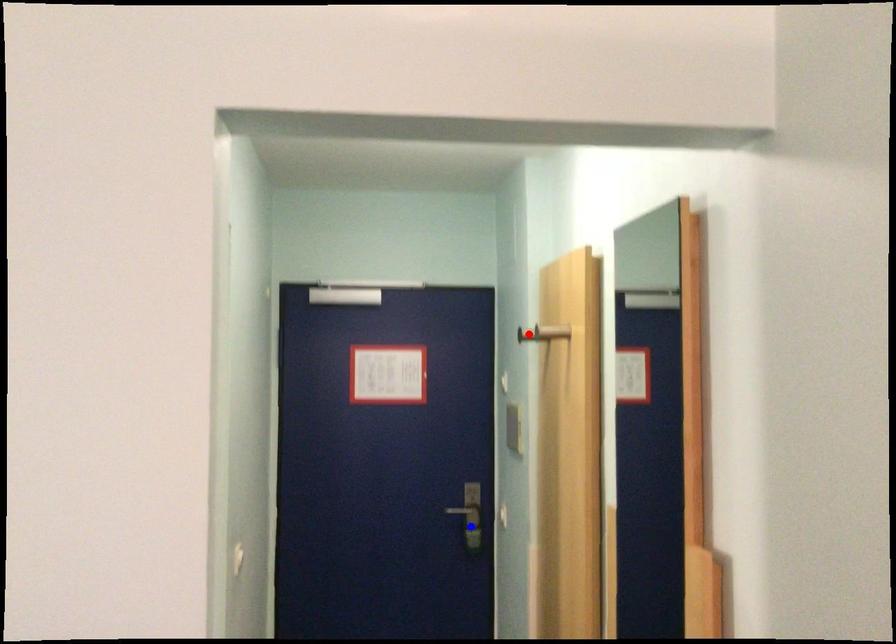
Question: Two points are marked on the image. Which point is closer to the camera?

Choices:
 (A) Blue point is closer.
 (B) Red point is closer.

Answer: (B)